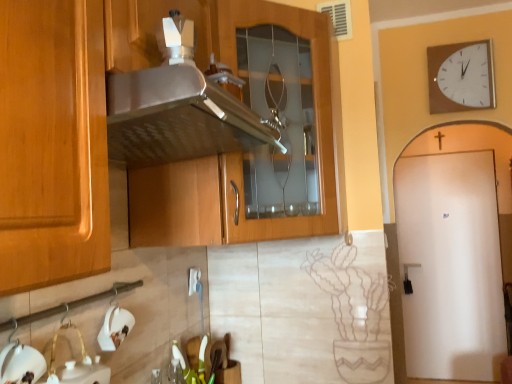
Question: Considering the relative positions of white glossy sink at lower left and white matte sink at lower left in the image provided, is white glossy sink at lower left behind white matte sink at lower left?

Choices:
 (A) yes
 (B) no

Answer: (B)

Question: Does white glossy sink at lower left lie in front of white matte sink at lower left?

Choices:
 (A) no
 (B) yes

Answer: (B)

Question: Considering the relative sizes of white glossy sink at lower left and white matte sink at lower left in the image provided, is white glossy sink at lower left shorter than white matte sink at lower left?

Choices:
 (A) yes
 (B) no

Answer: (A)

Question: Is white glossy sink at lower left taller than white matte sink at lower left?

Choices:
 (A) no
 (B) yes

Answer: (A)

Question: Is white glossy sink at lower left looking in the opposite direction of white matte sink at lower left?

Choices:
 (A) no
 (B) yes

Answer: (A)

Question: Would you consider white glossy sink at lower left to be distant from white matte sink at lower left?

Choices:
 (A) no
 (B) yes

Answer: (A)

Question: Is white matte door at right closer to the viewer compared to white matte sink at lower left?

Choices:
 (A) no
 (B) yes

Answer: (A)

Question: Does white matte door at right appear on the right side of white matte sink at lower left?

Choices:
 (A) yes
 (B) no

Answer: (A)

Question: Is white matte door at right oriented towards white matte sink at lower left?

Choices:
 (A) yes
 (B) no

Answer: (B)

Question: Is white matte door at right further to camera compared to white matte sink at lower left?

Choices:
 (A) yes
 (B) no

Answer: (A)

Question: Can you confirm if white matte door at right is positioned to the left of white matte sink at lower left?

Choices:
 (A) yes
 (B) no

Answer: (B)

Question: Considering the relative sizes of white matte door at right and white matte sink at lower left in the image provided, is white matte door at right taller than white matte sink at lower left?

Choices:
 (A) no
 (B) yes

Answer: (B)

Question: From the image's perspective, is satin wood cabinet at center located beneath white matte sink at lower left?

Choices:
 (A) no
 (B) yes

Answer: (A)